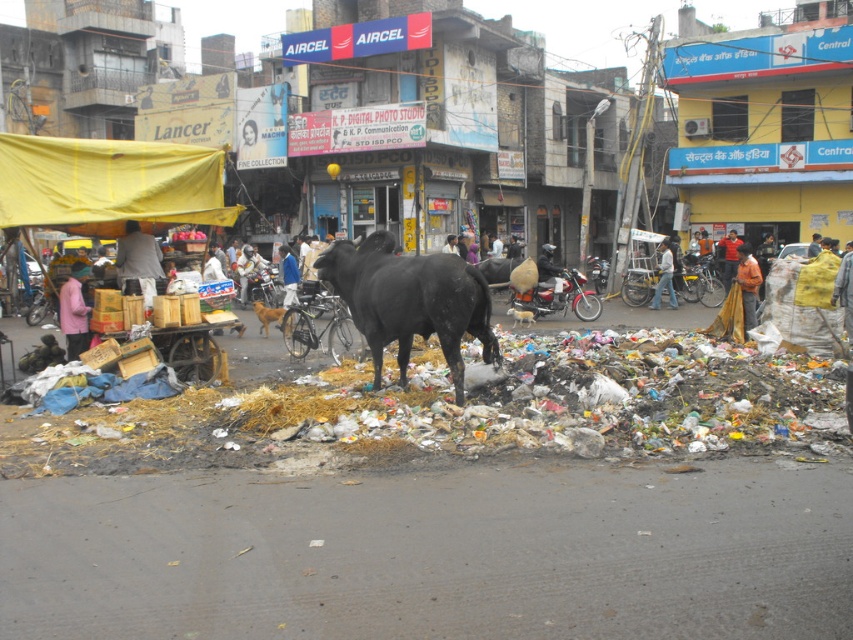
Between point (440, 282) and point (265, 337), which one is positioned behind?

Positioned behind is point (265, 337).

Can you confirm if black matte bull at center is positioned to the left of brown fur dog at center?

In fact, black matte bull at center is to the right of brown fur dog at center.

This screenshot has width=853, height=640. Describe the element at coordinates (410, 301) in the screenshot. I see `black matte bull at center` at that location.

At what (x,y) coordinates should I click in order to perform the action: click on black matte bull at center. Please return your answer as a coordinate pair (x, y). Looking at the image, I should click on (410, 301).

Between pink fabric at lower left and jeans at center, which one appears on the right side from the viewer's perspective?

From the viewer's perspective, jeans at center appears more on the right side.

Who is lower down, pink fabric at lower left or jeans at center?

pink fabric at lower left

Locate an element on the screen. The width and height of the screenshot is (853, 640). pink fabric at lower left is located at coordinates (74, 310).

Can you confirm if smooth skin face at center is shorter than orange cotton shirt at center?

Yes, smooth skin face at center is shorter than orange cotton shirt at center.

Can you confirm if smooth skin face at center is positioned to the left of orange cotton shirt at center?

Indeed, smooth skin face at center is positioned on the left side of orange cotton shirt at center.

Find the location of a particular element. This screenshot has width=853, height=640. smooth skin face at center is located at coordinates (250, 145).

Locate an element on the screen. smooth skin face at center is located at coordinates (250, 145).